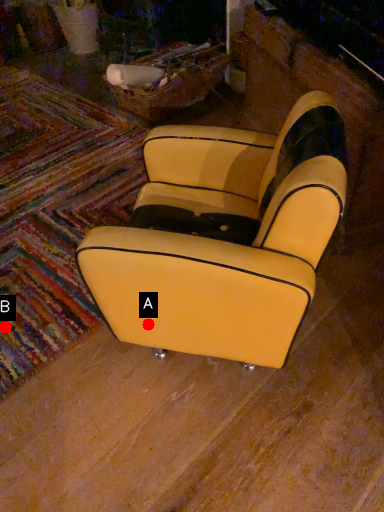
Question: Two points are circled on the image, labeled by A and B beside each circle. Which point is further to the camera?

Choices:
 (A) A is further
 (B) B is further

Answer: (B)